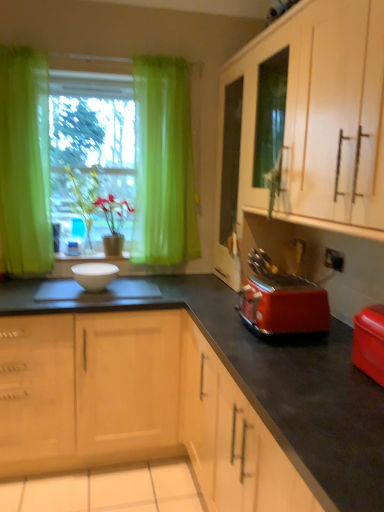
Identify the location of vacant area located to the right-hand side of white glossy bowl at center. (145, 287).